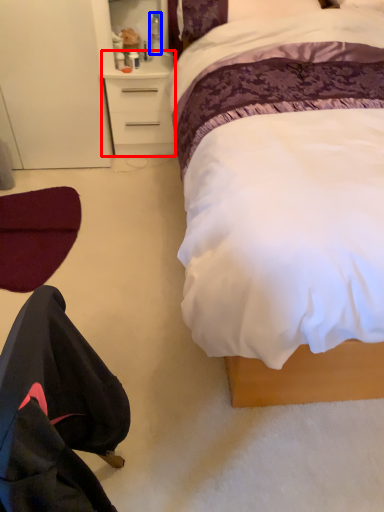
Question: Which of the following is the farthest to the observer, desk (highlighted by a red box) or bottle (highlighted by a blue box)?

Choices:
 (A) desk
 (B) bottle

Answer: (B)